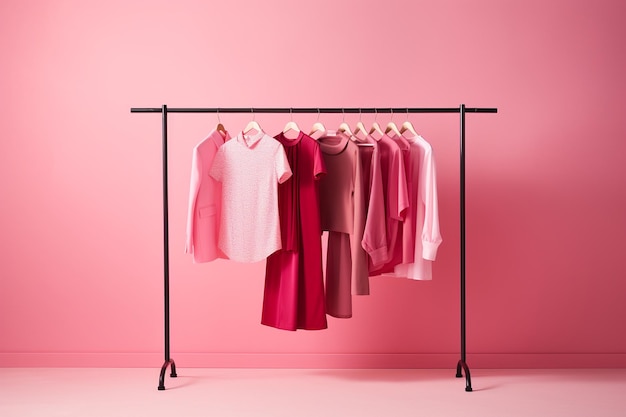
Image resolution: width=626 pixels, height=417 pixels. In order to click on clothing hangers in this screenshot , I will do pyautogui.click(x=407, y=123), pyautogui.click(x=390, y=125), pyautogui.click(x=374, y=127), pyautogui.click(x=359, y=125), pyautogui.click(x=342, y=125), pyautogui.click(x=317, y=125), pyautogui.click(x=292, y=125), pyautogui.click(x=252, y=125), pyautogui.click(x=220, y=127).